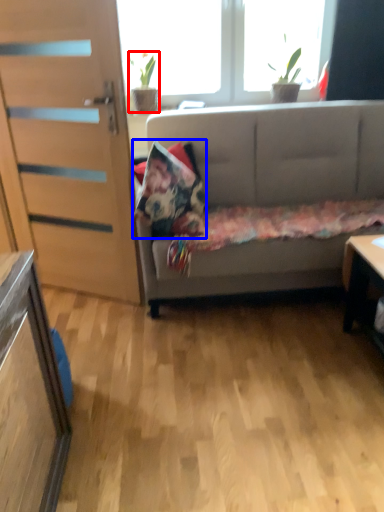
Question: Which object is further to the camera taking this photo, houseplant (highlighted by a red box) or pillow (highlighted by a blue box)?

Choices:
 (A) houseplant
 (B) pillow

Answer: (A)